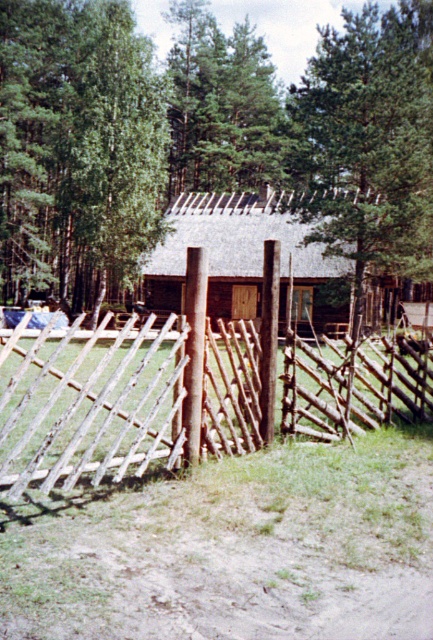
Is green matte tree at upper center below brown wooden log cabin at center?

No, green matte tree at upper center is not below brown wooden log cabin at center.

Find the location of a particular element. green matte tree at upper center is located at coordinates (222, 106).

Does green leafy tree at center lie behind green leafy tree at upper center?

Yes, it is.

Between green leafy tree at center and green leafy tree at upper center, which one is positioned lower?

green leafy tree at upper center

Does point (74, 16) come farther from viewer compared to point (351, 170)?

Yes, point (74, 16) is behind point (351, 170).

Identify the location of green leafy tree at center. (77, 147).

Can you confirm if rustic wooden gate at center is positioned to the left of green matte tree at upper center?

No, rustic wooden gate at center is not to the left of green matte tree at upper center.

Does point (86, 339) come behind point (258, 96)?

No, (86, 339) is closer to viewer.

The image size is (433, 640). Describe the element at coordinates (132, 394) in the screenshot. I see `rustic wooden gate at center` at that location.

The image size is (433, 640). Find the location of `rustic wooden gate at center`. rustic wooden gate at center is located at coordinates (132, 394).